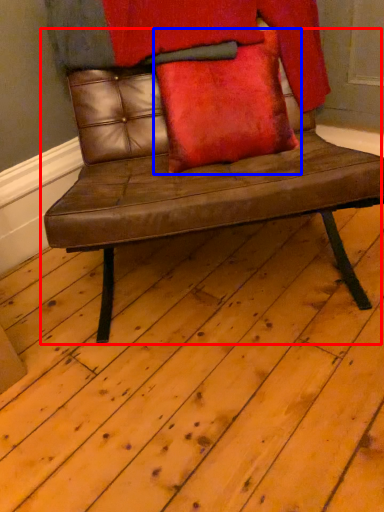
Question: Which point is further to the camera, chair (highlighted by a red box) or pillow (highlighted by a blue box)?

Choices:
 (A) chair
 (B) pillow

Answer: (B)